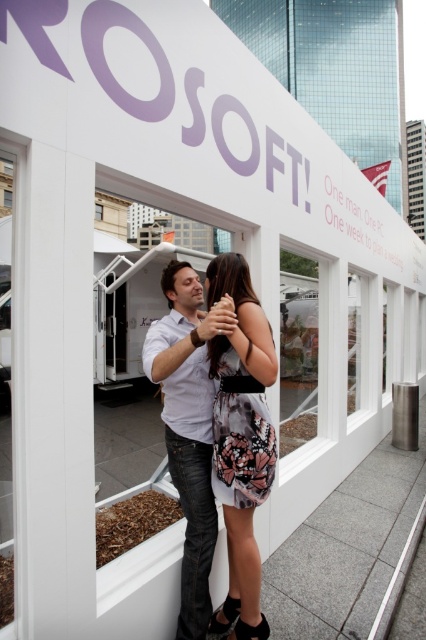
Question: Which of the following is the closest to the observer?

Choices:
 (A) (252, 480)
 (B) (170, 412)

Answer: (A)

Question: Can you confirm if floral-patterned dress at center is positioned above denim jeans at center?

Choices:
 (A) yes
 (B) no

Answer: (B)

Question: Can you confirm if floral-patterned dress at center is thinner than denim jeans at center?

Choices:
 (A) yes
 (B) no

Answer: (A)

Question: Which object appears closest to the camera in this image?

Choices:
 (A) denim jeans at center
 (B) floral-patterned dress at center

Answer: (B)

Question: Which object is closer to the camera taking this photo?

Choices:
 (A) floral-patterned dress at center
 (B) denim jeans at center

Answer: (A)

Question: Can you confirm if floral-patterned dress at center is wider than denim jeans at center?

Choices:
 (A) yes
 (B) no

Answer: (B)